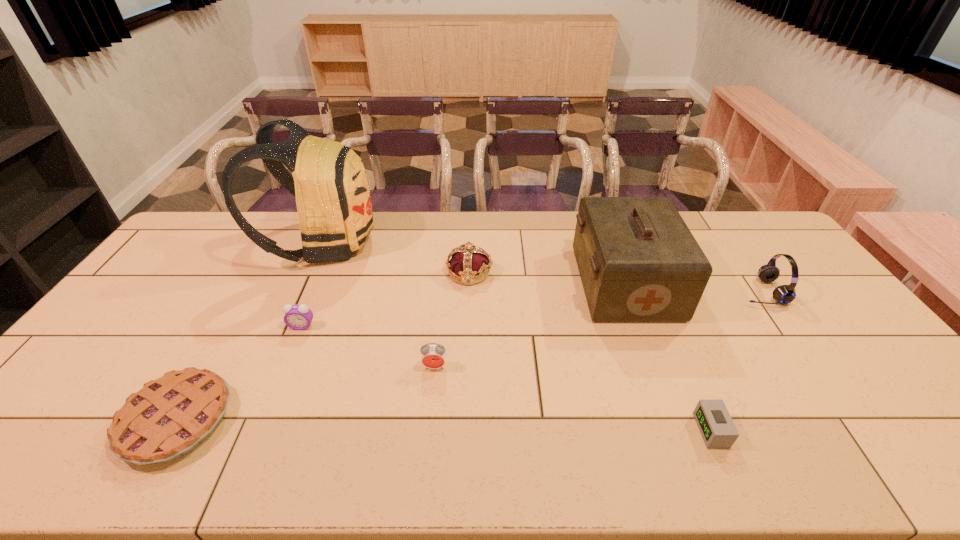
Image resolution: width=960 pixels, height=540 pixels. In order to click on free region at the right edge of the desktop in this screenshot , I will do `click(834, 338)`.

Where is `empty space between the backpack and the sixth tallest object`? This screenshot has width=960, height=540. empty space between the backpack and the sixth tallest object is located at coordinates (313, 285).

I want to click on unoccupied area between the nearest alarm clock and the farthest alarm clock, so click(x=507, y=378).

At what (x,y) coordinates should I click in order to perform the action: click on free space between the first-aid kit and the rightmost alarm clock. Please return your answer as a coordinate pair (x, y). Looking at the image, I should click on (668, 357).

The height and width of the screenshot is (540, 960). I want to click on vacant area that lies between the shortest alarm clock and the rightmost object, so click(x=735, y=361).

At what (x,y) coordinates should I click in order to perform the action: click on vacant area that lies between the first-aid kit and the tallest alarm clock. Please return your answer as a coordinate pair (x, y). Looking at the image, I should click on (530, 325).

Identify the location of vacant space in between the sixth farthest object and the first-aid kit. The height and width of the screenshot is (540, 960). (530, 325).

The width and height of the screenshot is (960, 540). Find the location of `unoccupied position between the backpack and the second alarm clock from right to left`. unoccupied position between the backpack and the second alarm clock from right to left is located at coordinates (379, 305).

Find the location of a particular element. free point between the first-aid kit and the second farthest alarm clock is located at coordinates (530, 325).

This screenshot has width=960, height=540. In order to click on free space between the nearest alarm clock and the backpack in this screenshot , I will do 517,336.